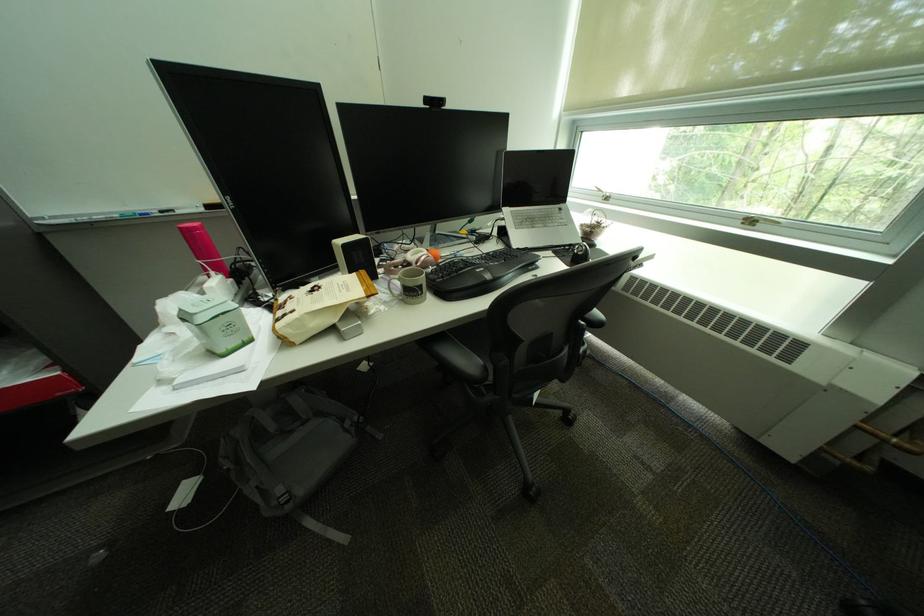
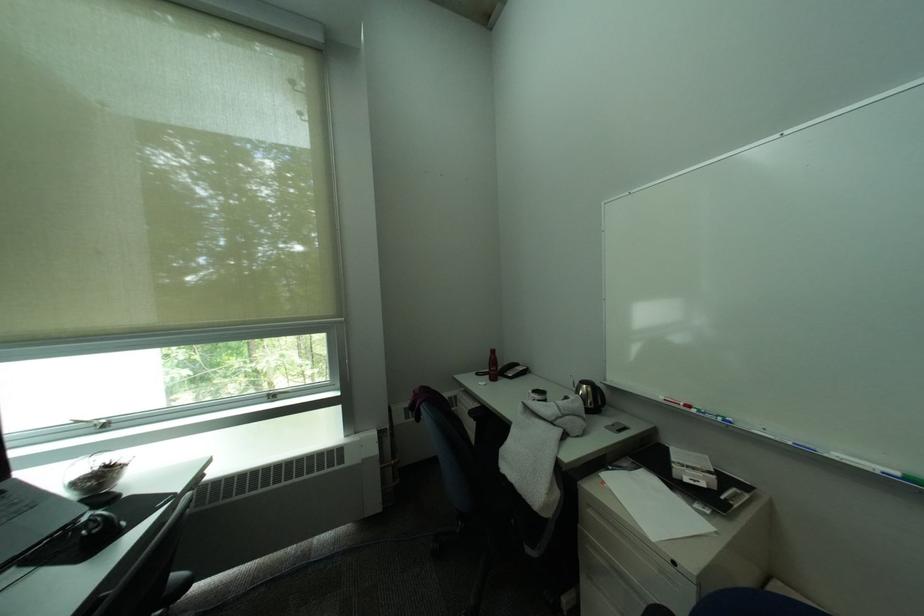
The point at (592, 225) is marked in the first image. Where is the corresponding point in the second image?

(84, 485)